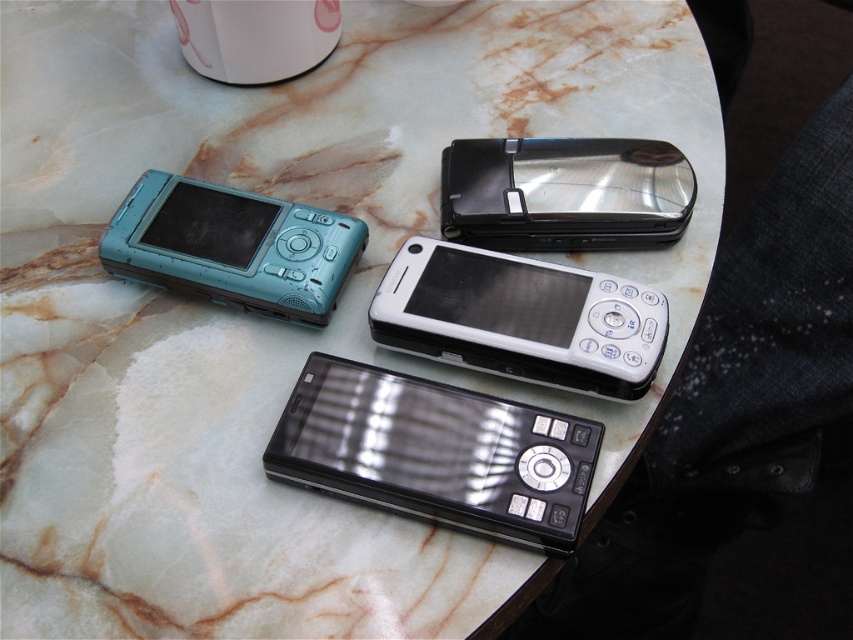
Question: Is white glossy smartphone at center positioned in front of teal plastic camera at upper left?

Choices:
 (A) yes
 (B) no

Answer: (A)

Question: Can you confirm if white glossy smartphone at center is positioned to the left of teal plastic camera at upper left?

Choices:
 (A) yes
 (B) no

Answer: (B)

Question: Which object appears closest to the camera in this image?

Choices:
 (A) metallic silver flip phone at upper right
 (B) white glossy smartphone at center

Answer: (B)

Question: Which point is closer to the camera taking this photo?

Choices:
 (A) (331, 237)
 (B) (583, 502)

Answer: (B)

Question: Estimate the real-world distances between objects in this image. Which object is closer to the white glossy smartphone at center?

Choices:
 (A) black glossy smartphone at center
 (B) teal plastic camera at upper left
 (C) metallic silver flip phone at upper right

Answer: (A)

Question: Can you confirm if white glossy smartphone at center is thinner than teal plastic camera at upper left?

Choices:
 (A) yes
 (B) no

Answer: (B)